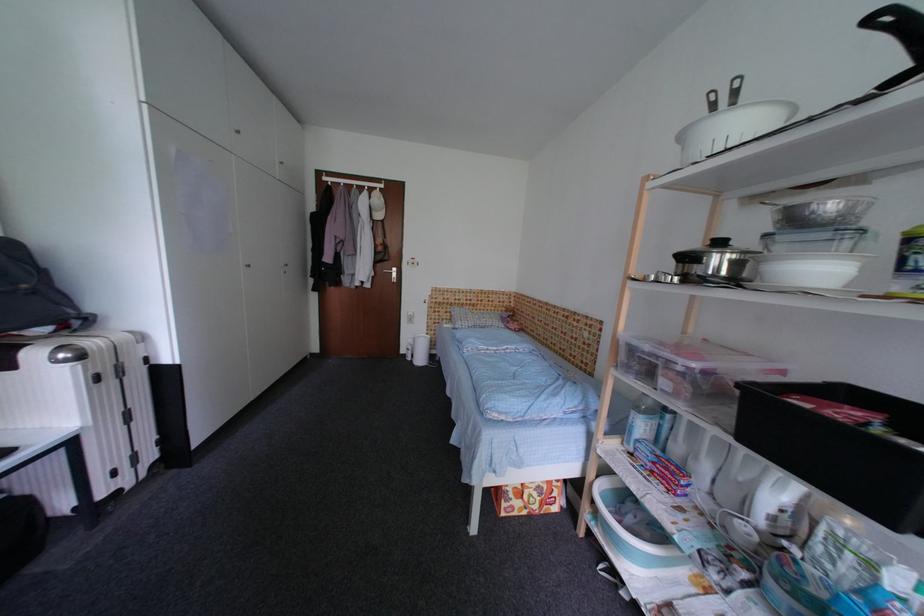
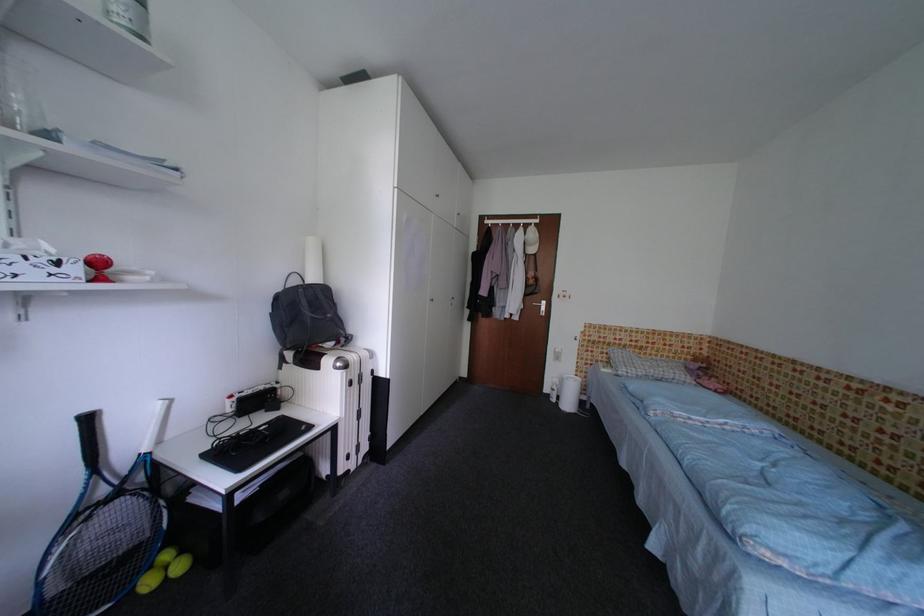
In the second image, find the point that corresponds to (373,196) in the first image.

(529, 232)